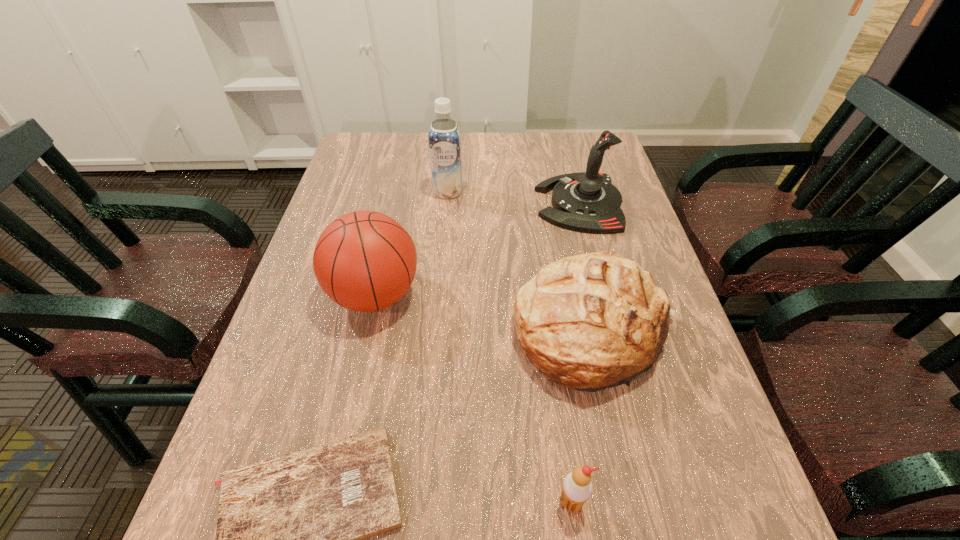
Locate an element on the screen. free region located on the left of the bread is located at coordinates (409, 334).

Locate an element on the screen. The height and width of the screenshot is (540, 960). object positioned at the left edge is located at coordinates (365, 261).

Find the location of a particular element. joystick situated at the right edge is located at coordinates [x=588, y=202].

The width and height of the screenshot is (960, 540). Find the location of `bread present at the right edge`. bread present at the right edge is located at coordinates (592, 321).

Identify the location of free space at the far edge of the desktop. (426, 142).

The width and height of the screenshot is (960, 540). Find the location of `vacant space at the left edge of the desktop`. vacant space at the left edge of the desktop is located at coordinates (315, 325).

Identify the location of blank area at the right edge. click(631, 206).

At what (x,y) coordinates should I click in order to perform the action: click on vacant space at the far left corner of the desktop. Please return your answer as a coordinate pair (x, y). This screenshot has width=960, height=540. Looking at the image, I should click on (366, 171).

The height and width of the screenshot is (540, 960). I want to click on blank region between the fourth tallest object and the basketball, so click(x=485, y=314).

Where is `vacant point located between the joystick and the tallest object`? The width and height of the screenshot is (960, 540). vacant point located between the joystick and the tallest object is located at coordinates (514, 198).